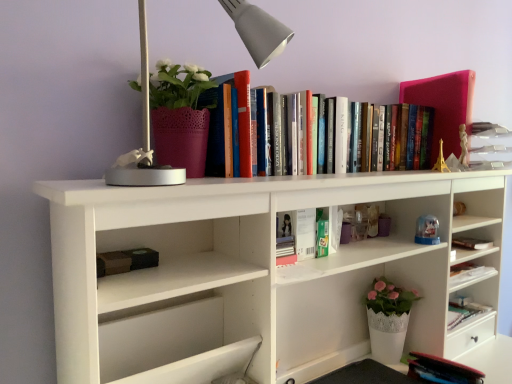
Question: Is matte pink pot at upper left oriented away from hardcover books at upper center, acting as the 3th book starting from the bottom?

Choices:
 (A) yes
 (B) no

Answer: (B)

Question: Considering the relative sizes of matte pink pot at upper left and hardcover books at upper center, acting as the 3th book starting from the bottom, in the image provided, is matte pink pot at upper left taller than hardcover books at upper center, acting as the 3th book starting from the bottom,?

Choices:
 (A) no
 (B) yes

Answer: (B)

Question: From a real-world perspective, is matte pink pot at upper left located beneath hardcover books at upper center, marked as the first book in a top-to-bottom arrangement?

Choices:
 (A) no
 (B) yes

Answer: (A)

Question: From the image's perspective, would you say matte pink pot at upper left is positioned over hardcover books at upper center, marked as the first book in a top-to-bottom arrangement?

Choices:
 (A) no
 (B) yes

Answer: (A)

Question: Considering the relative sizes of matte pink pot at upper left and hardcover books at upper center, acting as the 3th book starting from the bottom, in the image provided, is matte pink pot at upper left bigger than hardcover books at upper center, acting as the 3th book starting from the bottom,?

Choices:
 (A) yes
 (B) no

Answer: (B)

Question: From a real-world perspective, is matte pink pot at upper left physically above hardcover books at upper center, marked as the first book in a top-to-bottom arrangement?

Choices:
 (A) no
 (B) yes

Answer: (B)

Question: From the image's perspective, is hardcover books at upper center, acting as the 3th book starting from the bottom, located beneath matte pink book at upper right?

Choices:
 (A) no
 (B) yes

Answer: (B)

Question: Is hardcover books at upper center, acting as the 3th book starting from the bottom, in contact with matte pink book at upper right?

Choices:
 (A) yes
 (B) no

Answer: (B)

Question: Considering the relative positions of hardcover books at upper center, acting as the 3th book starting from the bottom, and matte pink book at upper right in the image provided, is hardcover books at upper center, acting as the 3th book starting from the bottom, in front of matte pink book at upper right?

Choices:
 (A) yes
 (B) no

Answer: (A)

Question: Considering the relative sizes of hardcover books at upper center, acting as the 3th book starting from the bottom, and matte pink book at upper right in the image provided, is hardcover books at upper center, acting as the 3th book starting from the bottom, taller than matte pink book at upper right?

Choices:
 (A) no
 (B) yes

Answer: (A)

Question: From a real-world perspective, is hardcover books at upper center, marked as the first book in a top-to-bottom arrangement, located higher than matte pink book at upper right?

Choices:
 (A) no
 (B) yes

Answer: (A)

Question: Can matte pink book at upper right be found inside hardcover books at upper center, acting as the 3th book starting from the bottom?

Choices:
 (A) yes
 (B) no

Answer: (B)

Question: Considering the relative sizes of green matte book at center, marked as the second book in a bottom-to-top arrangement, and matte pink pot at upper left in the image provided, is green matte book at center, marked as the second book in a bottom-to-top arrangement, shorter than matte pink pot at upper left?

Choices:
 (A) no
 (B) yes

Answer: (B)